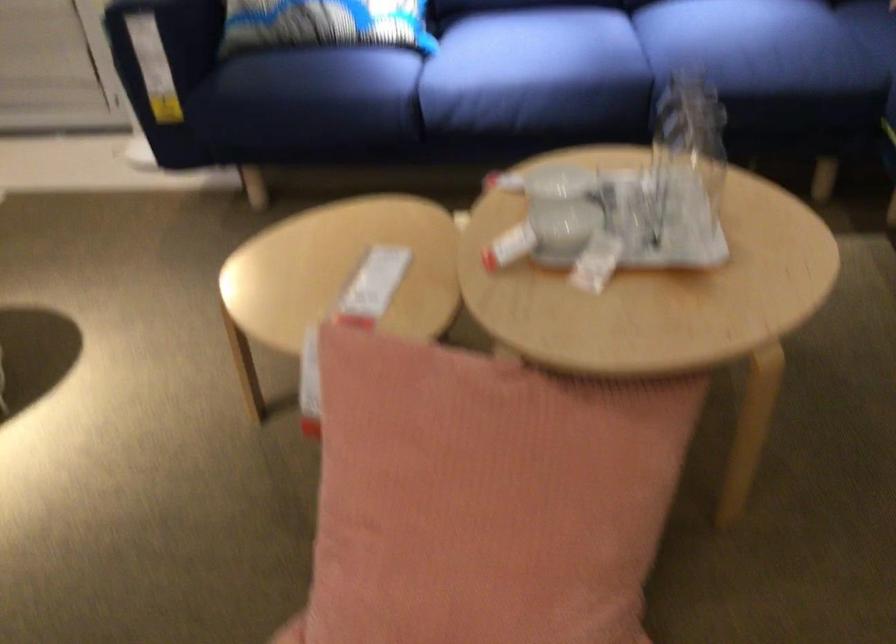
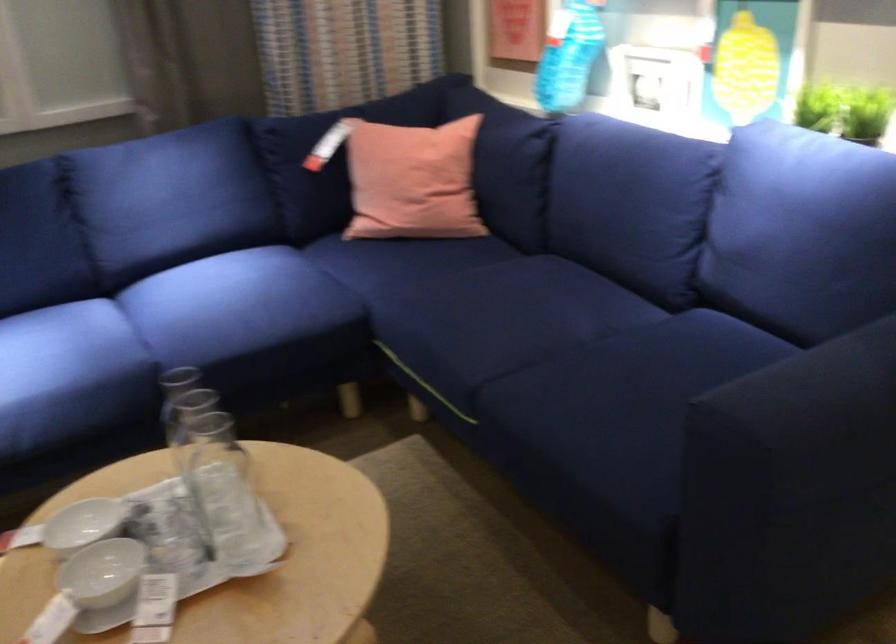
Where in the second image is the point corresponding to (x=545, y=225) from the first image?

(102, 572)